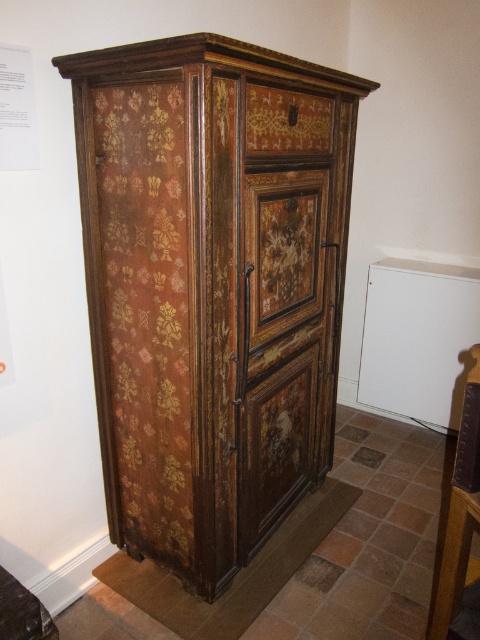
Question: Among these objects, which one is nearest to the camera?

Choices:
 (A) rustic wood drawer at center
 (B) gold-patterned wood door at center
 (C) wooden floral-patterned cabinet at center

Answer: (C)

Question: Based on their relative distances, which object is farther from the rustic wood drawer at center?

Choices:
 (A) gold-patterned wood drawer at upper center
 (B) wooden floral-patterned cabinet at center

Answer: (A)

Question: Is wooden floral-patterned cabinet at center to the right of gold-patterned wood door at center from the viewer's perspective?

Choices:
 (A) yes
 (B) no

Answer: (B)

Question: Which point is closer to the camera?

Choices:
 (A) gold-patterned wood door at center
 (B) wooden floral-patterned cabinet at center

Answer: (B)

Question: Does gold-patterned wood drawer at upper center appear under rustic wood drawer at center?

Choices:
 (A) no
 (B) yes

Answer: (A)

Question: Can you confirm if gold-patterned wood drawer at upper center is positioned to the left of rustic wood drawer at center?

Choices:
 (A) no
 (B) yes

Answer: (A)